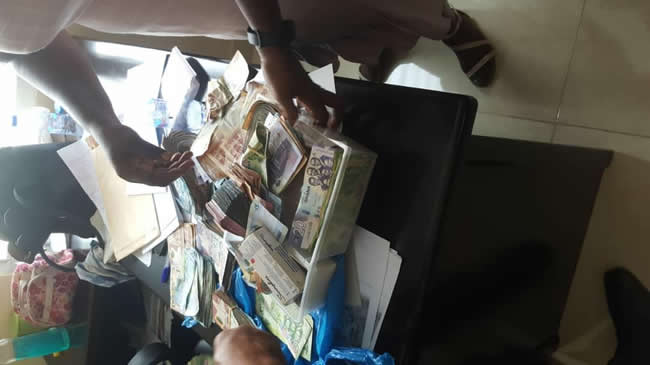
Identify the location of table. The width and height of the screenshot is (650, 365). (535, 225).